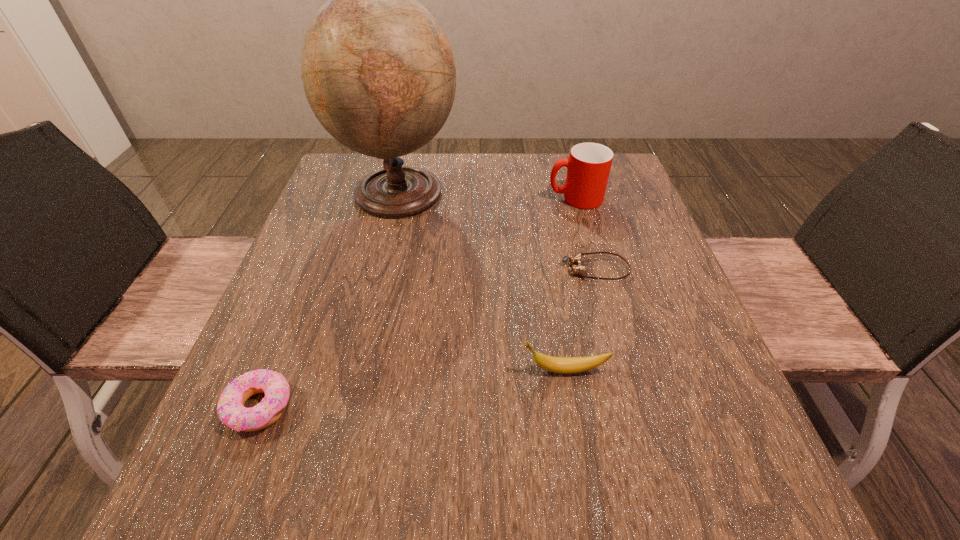
This screenshot has height=540, width=960. I want to click on free region located 0.090m on the side of the second tallest object with the handle, so click(513, 198).

Where is `vacant space located on the side of the second tallest object with the handle`? vacant space located on the side of the second tallest object with the handle is located at coordinates (469, 198).

Image resolution: width=960 pixels, height=540 pixels. Identify the location of free space located at the stem of the third shortest object. (445, 370).

This screenshot has height=540, width=960. What are the coordinates of `vacant region located at the stem of the third shortest object` in the screenshot? It's located at (300, 370).

Identify the location of vacant space located 0.200m at the stem of the third shortest object. The width and height of the screenshot is (960, 540). (404, 370).

You are a GUI agent. You are given a task and a screenshot of the screen. Output one action in this format:
    pyautogui.click(x=<x>, y=<y>)
    Task: Click on the free point located 0.230m on the back of the second shortest object
    Image resolution: width=960 pixels, height=540 pixels.
    Given the screenshot: What is the action you would take?
    pyautogui.click(x=309, y=282)

What are the coordinates of `vacant space situated 0.050m on the front lenses and sides of the shortest object` in the screenshot? It's located at [x=539, y=269].

Where is `vacant area situated on the front lenses and sides of the shortest object`? This screenshot has height=540, width=960. vacant area situated on the front lenses and sides of the shortest object is located at coordinates (379, 269).

Where is `free spot located on the front lenses and sides of the shortest object`? The width and height of the screenshot is (960, 540). free spot located on the front lenses and sides of the shortest object is located at coordinates (483, 269).

Find the location of a particular element. globe that is at the far edge is located at coordinates (378, 71).